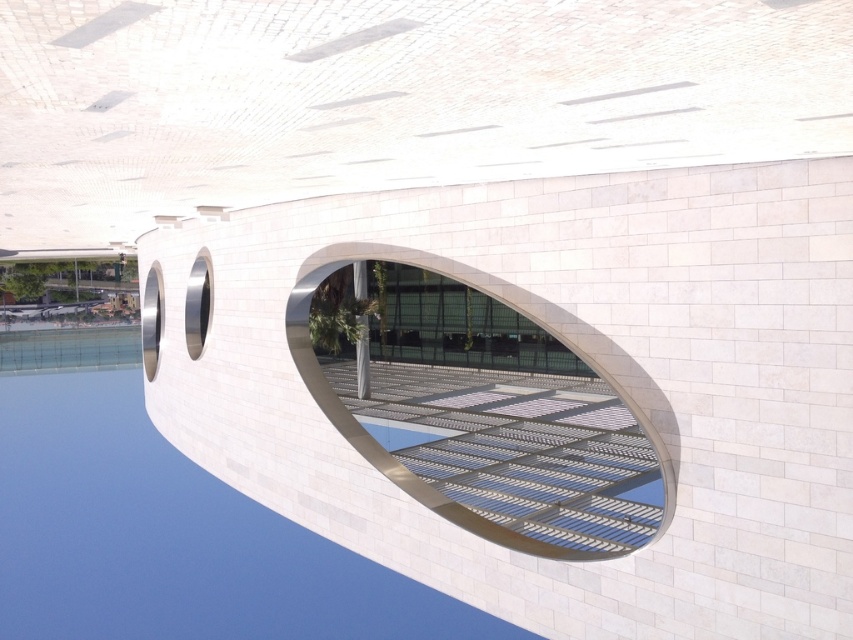
You are an architect analyzing the building facade. You notice the transparent glass water at center and the metallic silver window at center. According to the scene, which object is positioned to the left of the other?

The transparent glass water at center is to the left of the metallic silver window at center.

You are an architect analyzing the building facade. You observe two points on the facade at coordinates point (254,602) and point (492,365). According to the image, which point is positioned further away from the viewer?

Point (254,602) is behind point (492,365), so it is positioned further away from the viewer.